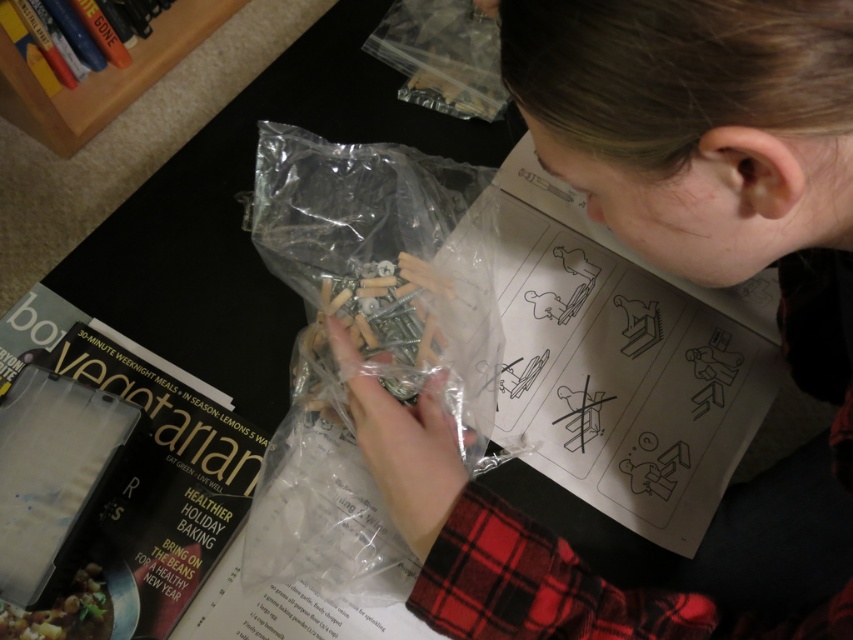
Question: Estimate the real-world distances between objects in this image. Which object is closer to the matte plastic bag of screws at center?

Choices:
 (A) hardcover book at upper left
 (B) matte black magazine at lower left

Answer: (B)

Question: Can you confirm if matte plastic bag of screws at center is positioned above wooden bookshelf at upper left?

Choices:
 (A) yes
 (B) no

Answer: (B)

Question: Among these objects, which one is nearest to the camera?

Choices:
 (A) matte black magazine at lower left
 (B) wooden bookshelf at upper left

Answer: (A)

Question: Is the position of matte plastic bag of screws at center more distant than that of hardcover book at upper left?

Choices:
 (A) yes
 (B) no

Answer: (B)

Question: Does wooden bookshelf at upper left have a smaller size compared to hardcover book at upper left?

Choices:
 (A) yes
 (B) no

Answer: (B)

Question: Based on their relative distances, which object is farther from the matte plastic bag of screws at center?

Choices:
 (A) hardcover book at upper left
 (B) matte black magazine at lower left
 (C) wooden bookshelf at upper left

Answer: (A)